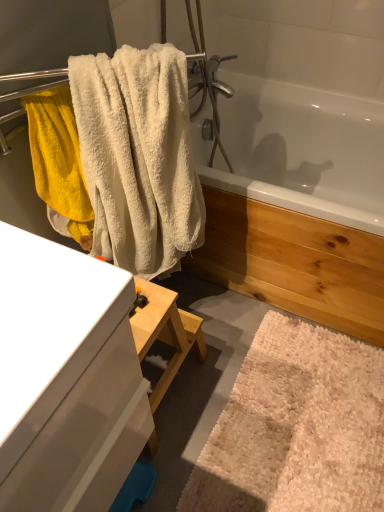
Question: Considering the relative positions of white fluffy bath mat at lower right and white fluffy towel at upper left in the image provided, is white fluffy bath mat at lower right to the right of white fluffy towel at upper left from the viewer's perspective?

Choices:
 (A) no
 (B) yes

Answer: (B)

Question: Is white fluffy bath mat at lower right thinner than white fluffy towel at upper left?

Choices:
 (A) no
 (B) yes

Answer: (A)

Question: Is white fluffy bath mat at lower right not near white fluffy towel at upper left?

Choices:
 (A) yes
 (B) no

Answer: (B)

Question: Is white fluffy bath mat at lower right completely or partially outside of white fluffy towel at upper left?

Choices:
 (A) no
 (B) yes

Answer: (B)

Question: Considering the relative sizes of white fluffy bath mat at lower right and white fluffy towel at upper left in the image provided, is white fluffy bath mat at lower right smaller than white fluffy towel at upper left?

Choices:
 (A) no
 (B) yes

Answer: (B)

Question: Is point (31, 481) positioned closer to the camera than point (259, 388)?

Choices:
 (A) farther
 (B) closer

Answer: (B)

Question: Is white glossy cabinet at left taller or shorter than white fluffy bath mat at lower right?

Choices:
 (A) tall
 (B) short

Answer: (A)

Question: In the image, is white glossy cabinet at left positioned in front of or behind white fluffy bath mat at lower right?

Choices:
 (A) front
 (B) behind

Answer: (A)

Question: Looking at their shapes, would you say white glossy cabinet at left is wider or thinner than white fluffy bath mat at lower right?

Choices:
 (A) wide
 (B) thin

Answer: (B)

Question: Looking at their shapes, would you say white glossy bathtub at upper center is wider or thinner than white glossy cabinet at left?

Choices:
 (A) wide
 (B) thin

Answer: (A)

Question: Considering the positions of white glossy bathtub at upper center and white glossy cabinet at left in the image, is white glossy bathtub at upper center taller or shorter than white glossy cabinet at left?

Choices:
 (A) tall
 (B) short

Answer: (A)

Question: Is white glossy bathtub at upper center to the left or to the right of white glossy cabinet at left in the image?

Choices:
 (A) left
 (B) right

Answer: (B)

Question: Considering the positions of white glossy bathtub at upper center and white glossy cabinet at left in the image, is white glossy bathtub at upper center bigger or smaller than white glossy cabinet at left?

Choices:
 (A) big
 (B) small

Answer: (A)

Question: Is white fluffy towel at upper left wider or thinner than white fluffy bath mat at lower right?

Choices:
 (A) wide
 (B) thin

Answer: (B)

Question: In terms of height, does white fluffy towel at upper left look taller or shorter compared to white fluffy bath mat at lower right?

Choices:
 (A) short
 (B) tall

Answer: (B)